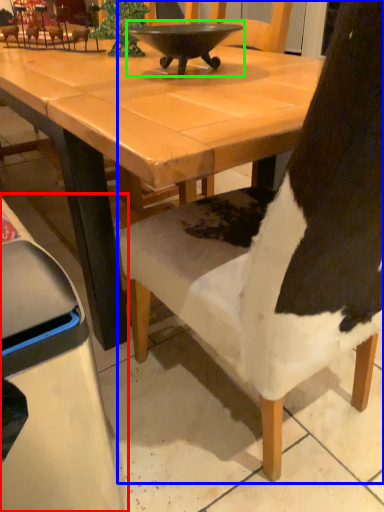
Question: Which object is the farthest from chair (highlighted by a red box)? Choose among these: chair (highlighted by a blue box) or bowl (highlighted by a green box).

Choices:
 (A) chair
 (B) bowl

Answer: (B)